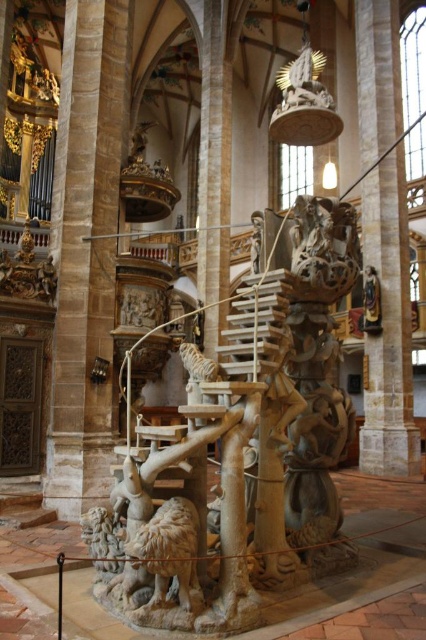
Is smooth stone pillar at center wider than carved stone sheep at center?

Indeed, smooth stone pillar at center has a greater width compared to carved stone sheep at center.

The height and width of the screenshot is (640, 426). Identify the location of smooth stone pillar at center. (72, 252).

Who is more forward, (86,3) or (176,522)?

Point (176,522) is more forward.

Where is `smooth stone pillar at center`? smooth stone pillar at center is located at coordinates (72, 252).

Which is below, carved stone sculpture at center or smooth stone pillar at right?

carved stone sculpture at center

Between point (316, 380) and point (406, 344), which one is positioned behind?

The point (406, 344) is more distant.

What are the coordinates of `carved stone sculpture at center` in the screenshot? It's located at (247, 444).

Can you confirm if smooth stone pillar at right is positioned to the right of smooth stone pillar at center?

Correct, you'll find smooth stone pillar at right to the right of smooth stone pillar at center.

In the scene shown: Does smooth stone pillar at right have a lesser height compared to smooth stone pillar at center?

Incorrect, smooth stone pillar at right's height does not fall short of smooth stone pillar at center's.

Between point (397, 61) and point (74, 211), which one is positioned in front?

Point (74, 211)

Where is `smooth stone pillar at right`? The width and height of the screenshot is (426, 640). smooth stone pillar at right is located at coordinates (388, 326).